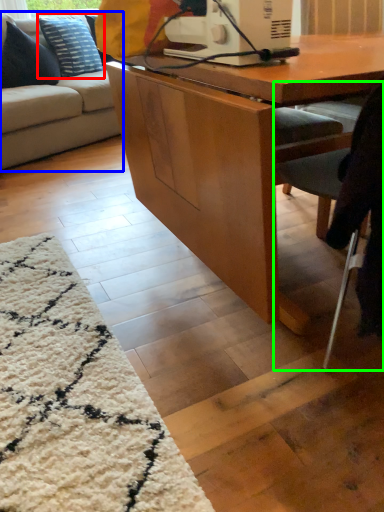
Question: Considering the real-world distances, which object is closest to pillow (highlighted by a red box)? studio couch (highlighted by a blue box) or chair (highlighted by a green box).

Choices:
 (A) studio couch
 (B) chair

Answer: (A)